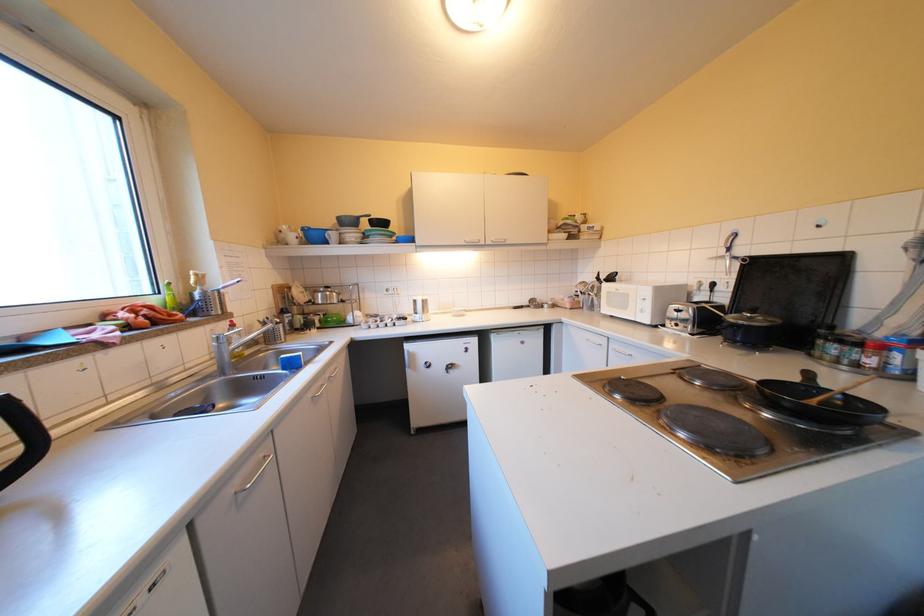
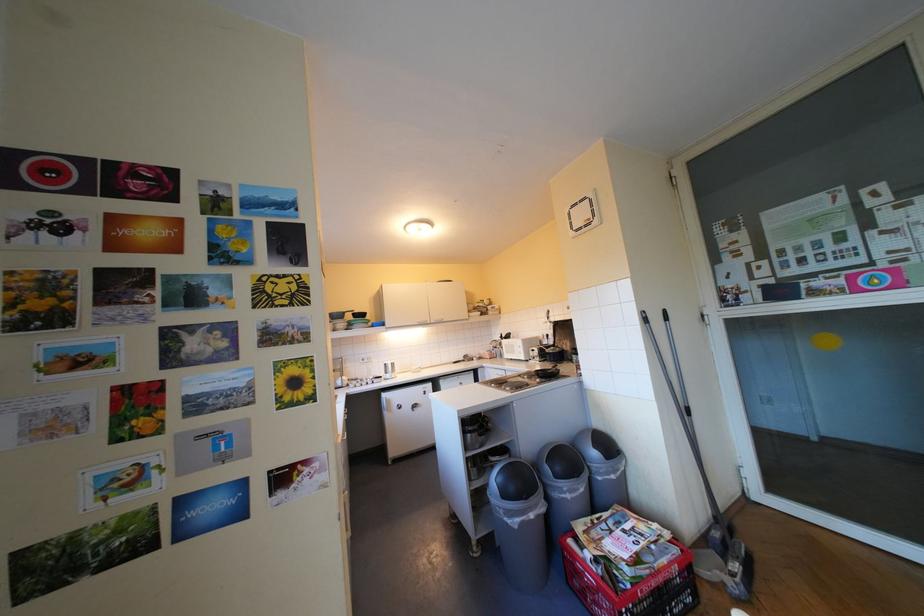
Question: Which direction would the cameraman need to move to produce the second image? Reply with the corresponding letter.

Choices:
 (A) Left
 (B) Right
 (C) Forward
 (D) Backward

Answer: (D)